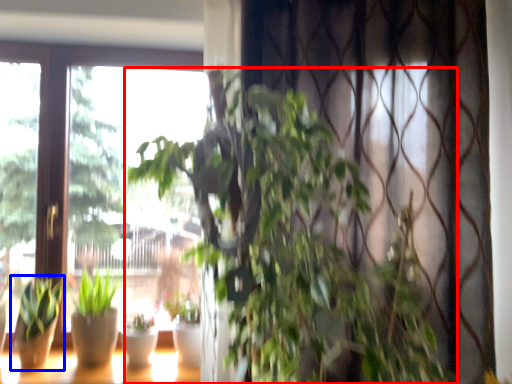
Question: Which point is closer to the camera, houseplant (highlighted by a red box) or houseplant (highlighted by a blue box)?

Choices:
 (A) houseplant
 (B) houseplant

Answer: (A)